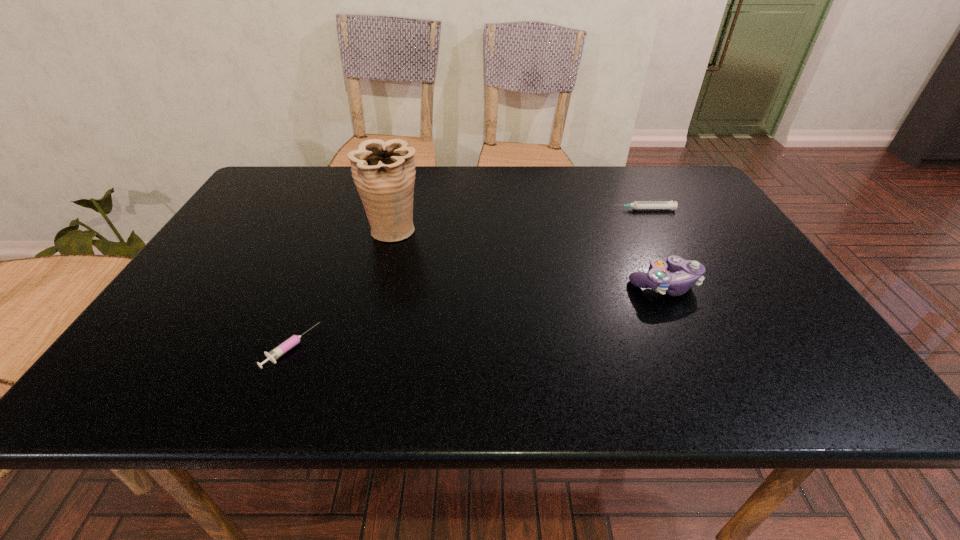
Locate an element on the screen. the tallest object is located at coordinates (384, 173).

The width and height of the screenshot is (960, 540). In order to click on the second farthest object in this screenshot , I will do `click(384, 173)`.

In order to click on the second tallest object in this screenshot , I will do `click(685, 273)`.

This screenshot has width=960, height=540. What are the coordinates of `control` in the screenshot? It's located at (685, 273).

You are a GUI agent. You are given a task and a screenshot of the screen. Output one action in this format:
    pyautogui.click(x=<x>, y=<y>)
    Task: Click on the right syringe
    The width and height of the screenshot is (960, 540).
    Given the screenshot: What is the action you would take?
    pyautogui.click(x=672, y=205)

Identify the location of the farthest object. The width and height of the screenshot is (960, 540). (672, 205).

The width and height of the screenshot is (960, 540). Identify the location of the shorter syringe. (273, 355).

Find the location of a particular element. The height and width of the screenshot is (540, 960). the left syringe is located at coordinates (273, 355).

Find the location of a particular element. This screenshot has height=540, width=960. vacant position located 0.330m on the right of the tallest object is located at coordinates (544, 230).

Locate an element on the screen. The height and width of the screenshot is (540, 960). vacant region located on the back of the third shortest object is located at coordinates (627, 208).